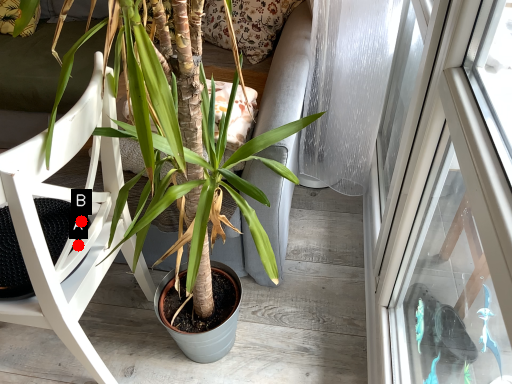
Question: Two points are circled on the image, labeled by A and B beside each circle. Among these points, which one is farthest from the camera?

Choices:
 (A) A is further
 (B) B is further

Answer: (A)